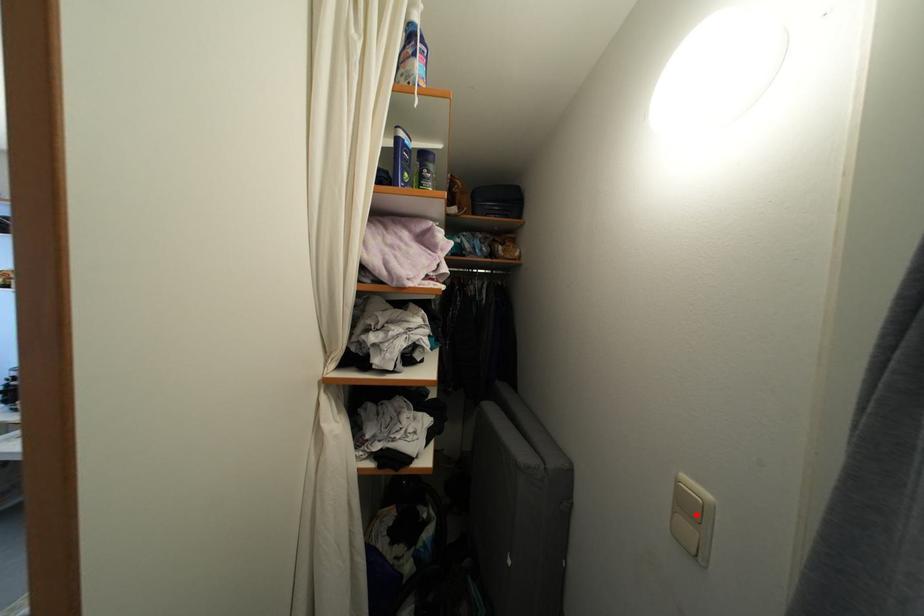
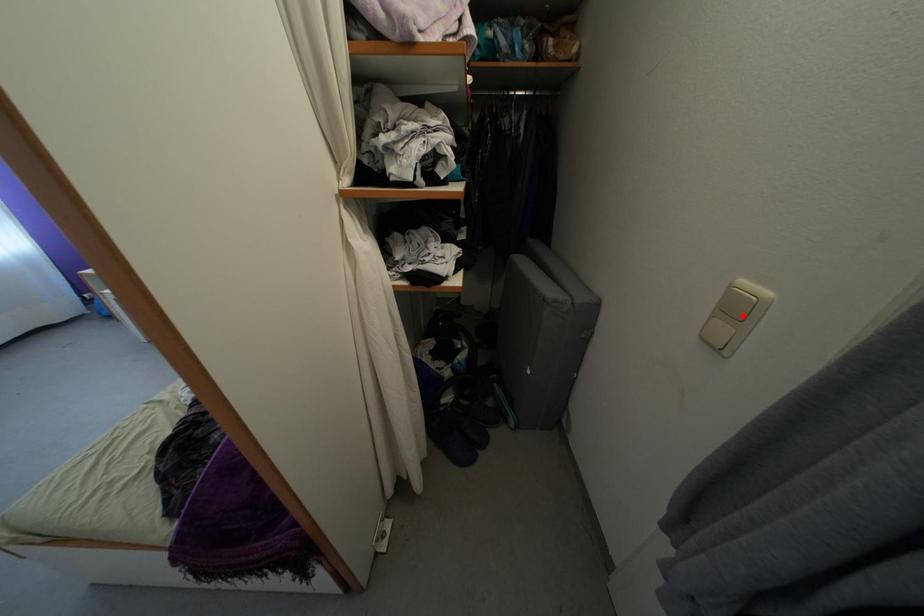
I am providing you with two images of the same scene from different viewpoints. A red point is marked on the first image and another point is marked on the second image. Do the highlighted points in image1 and image2 indicate the same real-world spot?

Yes